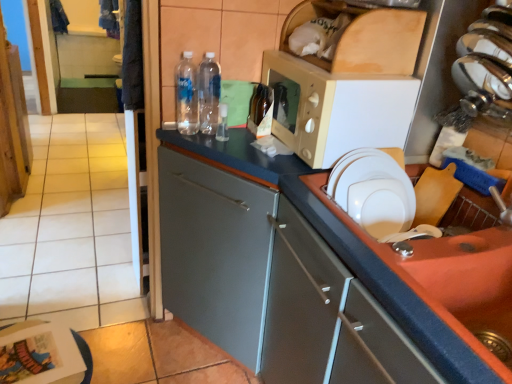
Locate an element on the screen. This screenshot has width=512, height=384. vacant space that is in between transparent plastic bottles at center, placed as the 2th bottle when sorted from right to left, and translucent glass bottle at center, marked as the 1th bottle in a right-to-left arrangement is located at coordinates (234, 132).